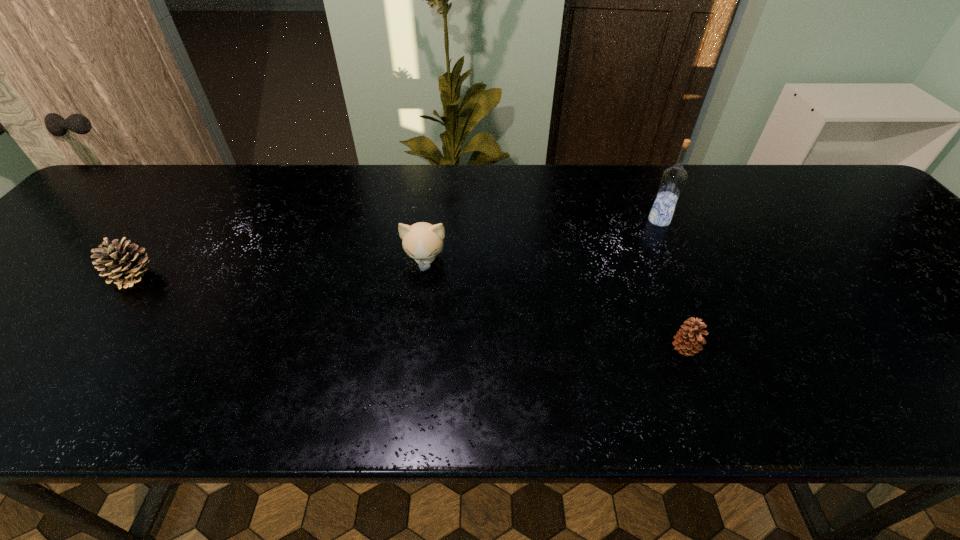
Locate an element on the screen. vodka is located at coordinates (673, 180).

At what (x,y) coordinates should I click in order to perform the action: click on the rightmost object. Please return your answer as a coordinate pair (x, y). Looking at the image, I should click on (673, 180).

Identify the location of kitten. Image resolution: width=960 pixels, height=540 pixels. (422, 241).

The width and height of the screenshot is (960, 540). Find the location of `the left pinecone`. the left pinecone is located at coordinates (125, 264).

Locate an element on the screen. The image size is (960, 540). the farther pinecone is located at coordinates (125, 264).

Where is `the shortest object`? the shortest object is located at coordinates (687, 341).

The image size is (960, 540). I want to click on the nearest object, so click(x=687, y=341).

I want to click on vacant space located on the back of the farthest object, so click(x=649, y=198).

What are the coordinates of `free location located on the face of the second object from left to right` in the screenshot? It's located at (411, 376).

Identify the location of free region located on the front of the taller pinecone. This screenshot has width=960, height=540. (27, 418).